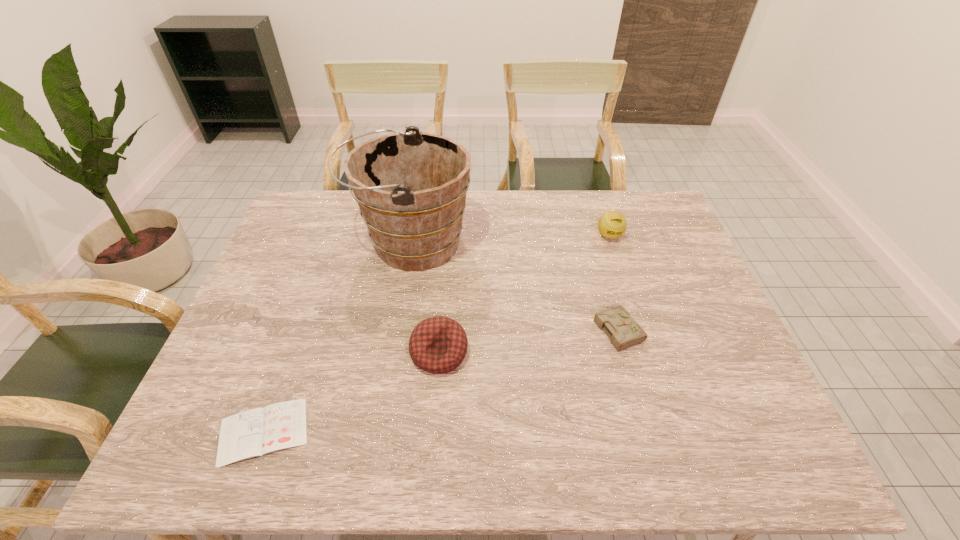
Identify the location of free location at the near edge. (299, 467).

Where is `free space at the left edge`? free space at the left edge is located at coordinates (287, 252).

In the image, there is a desktop. Identify the location of vacant space at the right edge. The image size is (960, 540). (670, 264).

Image resolution: width=960 pixels, height=540 pixels. I want to click on free space at the far right corner of the desktop, so click(x=624, y=192).

Locate an element on the screen. The height and width of the screenshot is (540, 960). vacant space at the near right corner of the desktop is located at coordinates (780, 448).

Locate an element on the screen. The image size is (960, 540). vacant area that lies between the softball and the beanbag is located at coordinates (524, 294).

You are a GUI agent. You are given a task and a screenshot of the screen. Output one action in this format:
    pyautogui.click(x=<x>, y=<y>)
    Task: Click on the vacant space that's between the nearer diary and the beanbag
    This screenshot has width=960, height=540.
    Given the screenshot: What is the action you would take?
    pyautogui.click(x=351, y=393)

Locate an element on the screen. free spot between the beanbag and the taller diary is located at coordinates (529, 340).

This screenshot has width=960, height=540. Find the location of `empty space that is in between the right diary and the softball`. empty space that is in between the right diary and the softball is located at coordinates (613, 282).

You are a GUI agent. You are given a task and a screenshot of the screen. Output one action in this format:
    pyautogui.click(x=<x>, y=<y>)
    Task: Click on the free space between the beanbag and the shortest object
    This screenshot has height=540, width=960.
    Given the screenshot: What is the action you would take?
    pyautogui.click(x=351, y=393)